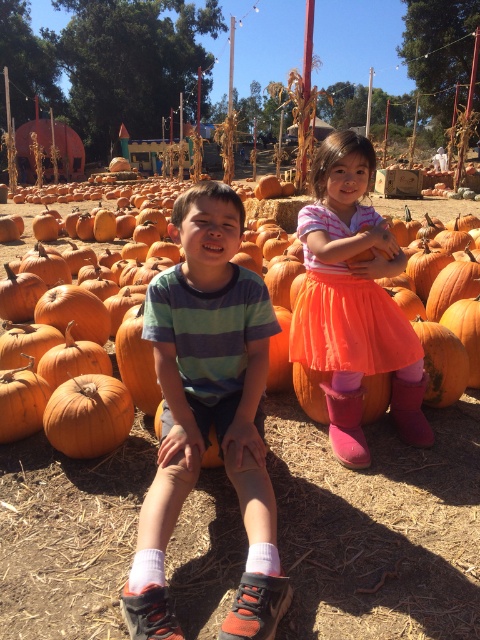
You are a photographer trying to capture both the pink tulle skirt at center and the orange matte pumpkin at center in a single frame. Based on their sizes, which object should you focus on first to ensure both fit in the shot?

The pink tulle skirt at center occupies less space than the orange matte pumpkin at center, so you should focus on positioning the orange matte pumpkin at center first to ensure it fits, then adjust the frame to include the smaller pink tulle skirt at center.